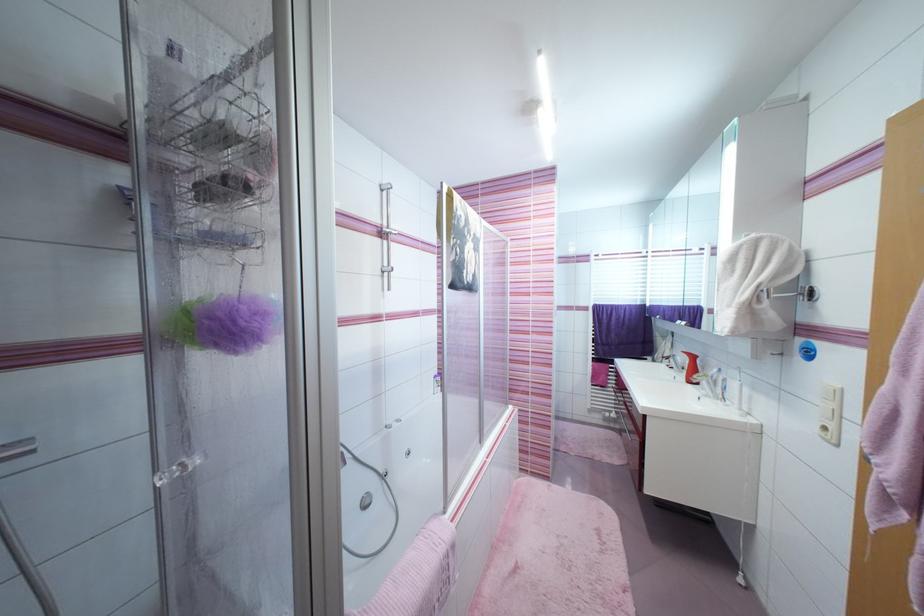
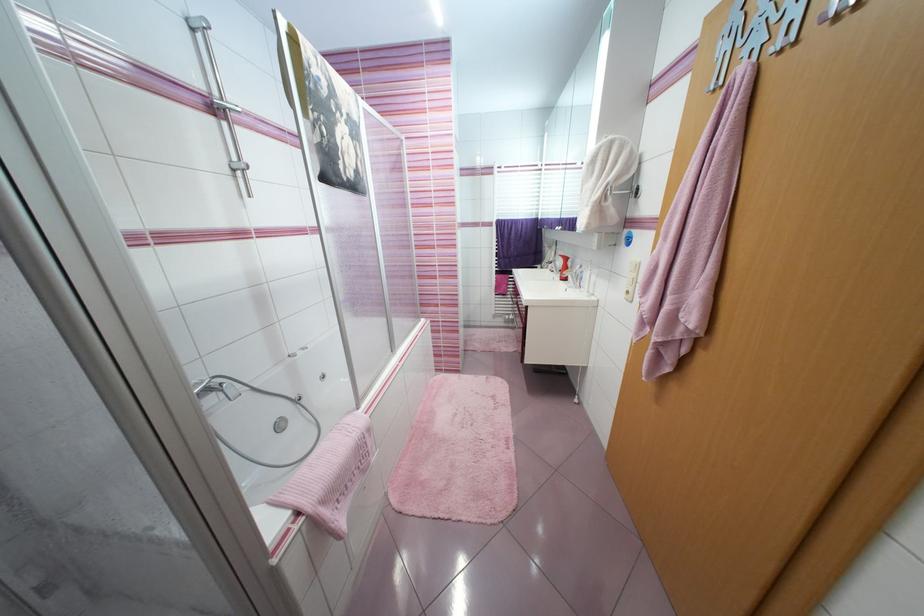
Where in the second image is the point corresponding to the point at 387,192 from the first image?

(198, 31)